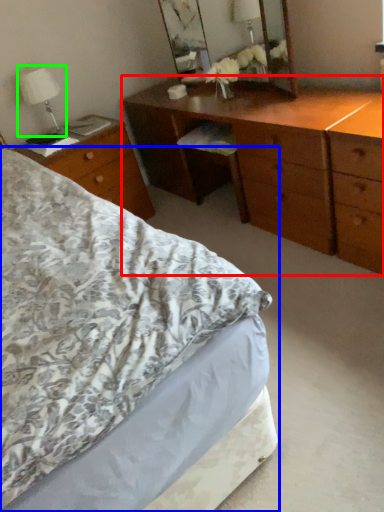
Question: Which object is the farthest from chest of drawers (highlighted by a red box)? Choose among these: bed (highlighted by a blue box) or bedside lamp (highlighted by a green box).

Choices:
 (A) bed
 (B) bedside lamp

Answer: (B)